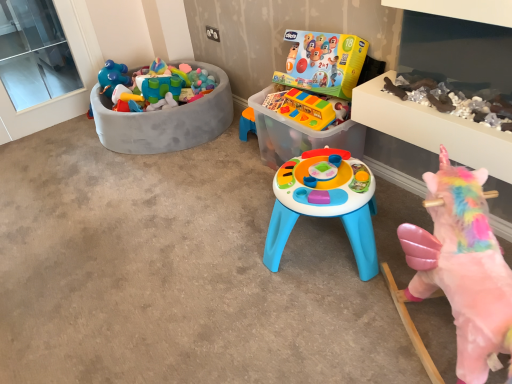
This screenshot has width=512, height=384. Find the location of `blank space situated above transparent plastic toy box at center (from a real-world perspective)`. blank space situated above transparent plastic toy box at center (from a real-world perspective) is located at coordinates (157, 223).